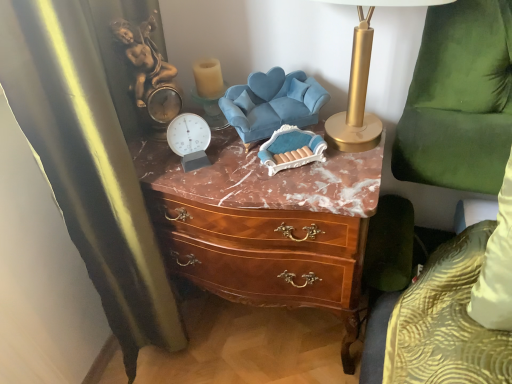
This screenshot has width=512, height=384. Identify the location of vacant area that is in front of metallic silver clock at center. (212, 186).